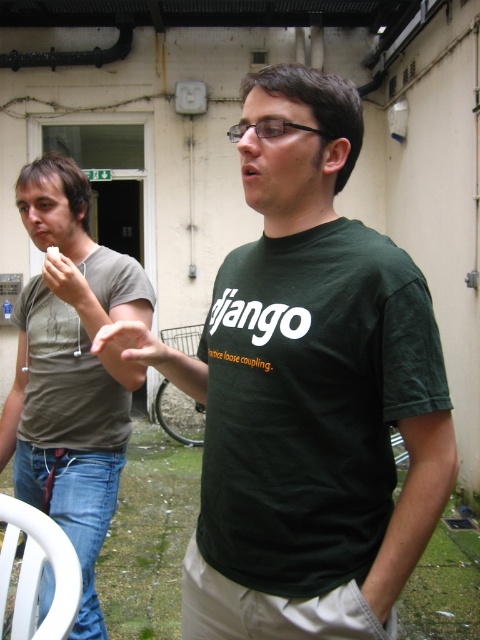
Question: Which point is farther to the camera?

Choices:
 (A) dark green t-shirt at center
 (B) white matte remote control at left
 (C) matte skin hand at center
 (D) matte gray t-shirt at left

Answer: (B)

Question: Estimate the real-world distances between objects in this image. Which object is farther from the white matte remote control at left?

Choices:
 (A) matte gray t-shirt at left
 (B) matte skin hand at center

Answer: (A)

Question: Does dark green t-shirt at center have a larger size compared to white matte remote control at left?

Choices:
 (A) yes
 (B) no

Answer: (A)

Question: Which object is farther from the camera taking this photo?

Choices:
 (A) white matte remote control at left
 (B) dark green t-shirt at center
 (C) matte skin hand at center
 (D) matte gray t-shirt at left

Answer: (A)

Question: Does matte skin hand at center come in front of white matte remote control at left?

Choices:
 (A) yes
 (B) no

Answer: (A)

Question: Does dark green t-shirt at center appear on the left side of matte gray t-shirt at left?

Choices:
 (A) yes
 (B) no

Answer: (B)